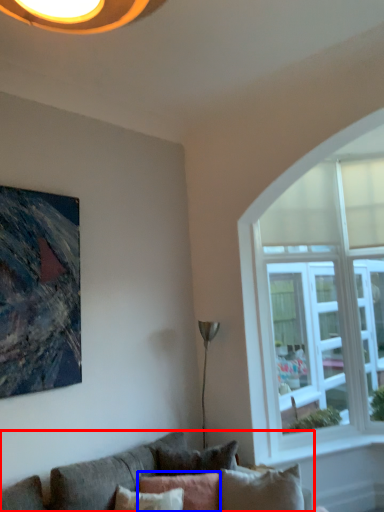
Question: Which of the following is the closest to the observer, studio couch (highlighted by a red box) or pillow (highlighted by a blue box)?

Choices:
 (A) studio couch
 (B) pillow

Answer: (A)